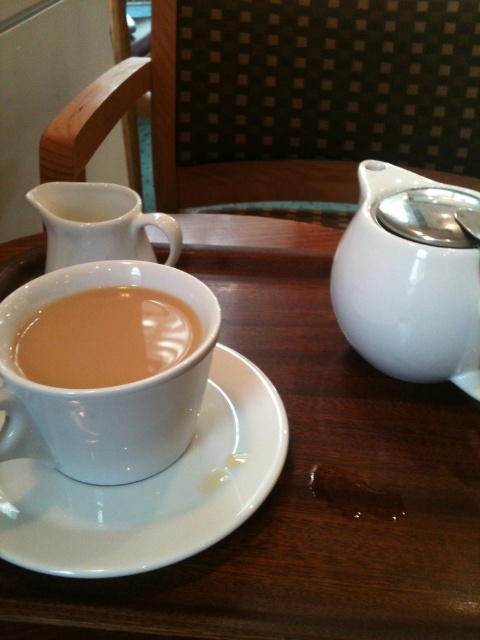
You are a barista in a cafe and need to place a new menu board on the wall. The menu board must be placed exactly at the position where the white glossy teapot at upper right is located. What are the coordinates of the point where you should place the menu board?

The coordinates for the white glossy teapot at upper right are at point (411, 276), so you should place the menu board at those coordinates.

You are a barista trying to place a matte ceramic cup at center onto the white glossy saucer at center. Given that the cup has a diameter of 3.5 inches, will it fit on the saucer without overhanging?

The distance between the white glossy saucer at center and matte ceramic cup at center is 2.90 inches. Since the cup has a diameter of 3.5 inches, the saucer must be at least 3.5 inches in diameter to fit the cup. However, the provided distance between them does not indicate the saucer size, so we cannot determine if the cup will fit based on the given information.